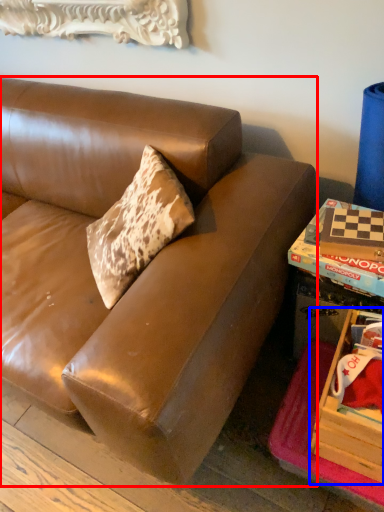
Question: Which of the following is the closest to the observer, studio couch (highlighted by a red box) or storage box (highlighted by a blue box)?

Choices:
 (A) studio couch
 (B) storage box

Answer: (A)